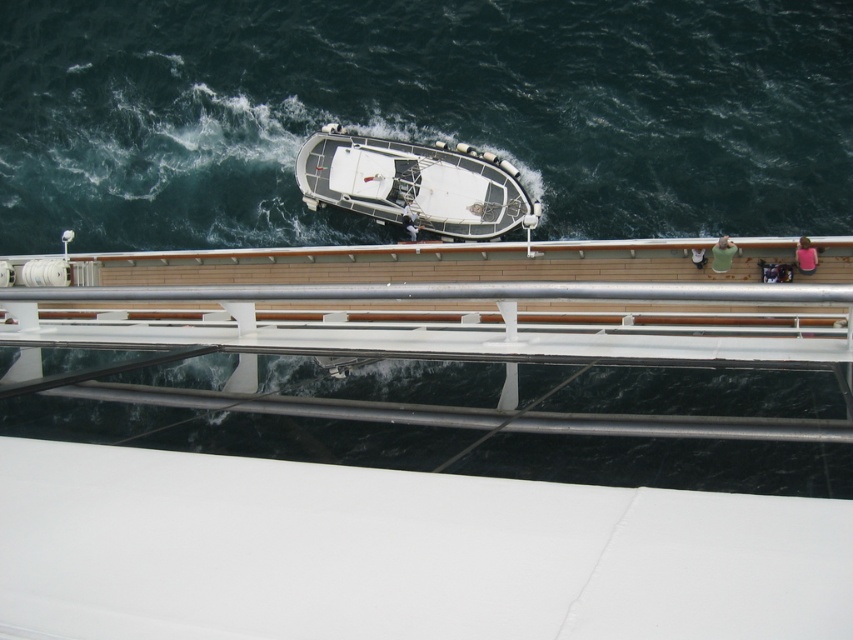
You are standing on the deck of the cruise ship and looking down at the smaller boat. There are two points marked on the boat, one at coordinates point (553, 132) and the other at point (720, 250). Which point is closer to you?

Point (553, 132) is closer to you because it is further to the camera than point (720, 250).

You are standing on the deck of the large vessel and want to locate the dark blue water at center. According to the coordinates provided, where exactly would you look?

The dark blue water at center is located at coordinates point (421, 113).

You are standing on the deck of the large vessel and see the point at coordinates (421, 113). What is the location of this point relative to the dark blue water at center?

The point at coordinates (421, 113) is located on the dark blue water at center.